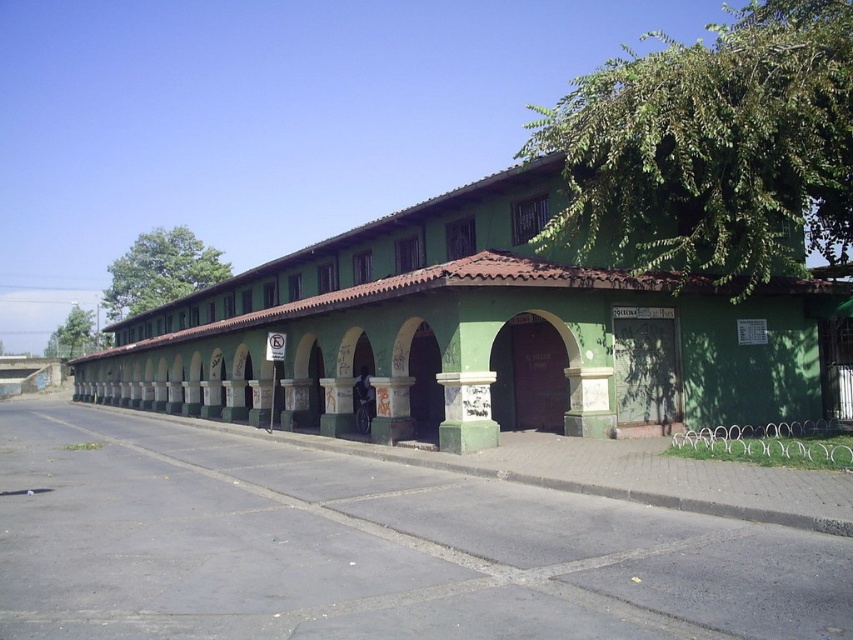
You are standing in front of the green building and want to take a photo that includes both the green leafy tree at upper right and the green leafy tree at upper left. Which tree should you position closer to the center of your camera frame to ensure both are fully visible?

The green leafy tree at upper right might be wider than the green leafy tree at upper left, so positioning the wider tree closer to the center of the camera frame would help ensure both are fully visible without cropping either.

You are standing on the sidewalk in front of the building and want to take a photo of both the green leafy tree at upper left and the green leafy tree at left. Which tree should you position yourself closer to in order to capture both in a single frame?

You should position yourself closer to the green leafy tree at left because the green leafy tree at upper left is wider, so moving closer to the narrower tree allows both to fit within the camera frame.

Consider the image. You are standing on the sidewalk in front of the building and want to take a photo of both the green leafy tree at upper left and the green leafy tree at left. Which tree should you position yourself closer to in order to capture both in the same frame?

You should position yourself closer to the green leafy tree at left because it is shorter than the green leafy tree at upper left, allowing both to fit within the camera frame more easily.